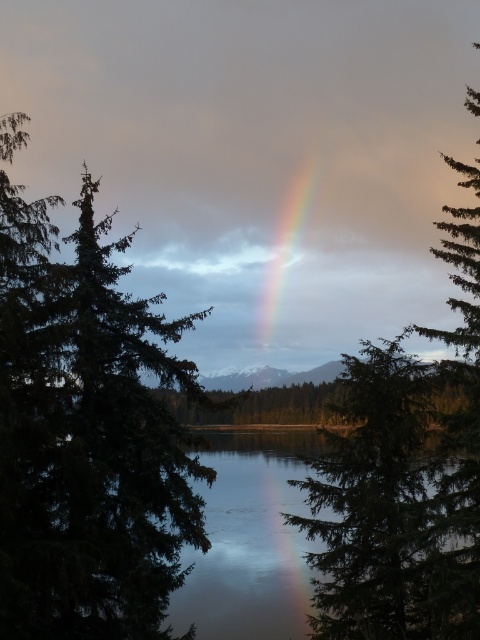
You are standing in the scene and want to take a photo of the rainbow. Where should you position yourself relative to the green matte tree at left to ensure the rainbow is fully visible in your frame?

To ensure the rainbow is fully visible in your frame, you should position yourself to the right of the green matte tree at left since the rainbow spans from the upper left to the lower right, and the tree is located at point (85, 438). Being to the right of it will allow the rainbow to be centered in your view.

You are standing at the center of the scene and see two points in the sky. The first point is labeled as point [311,429] and the second is point [291,260]. Which point appears closer to you?

Point [311,429] is in front of point [291,260], so it appears closer to you.